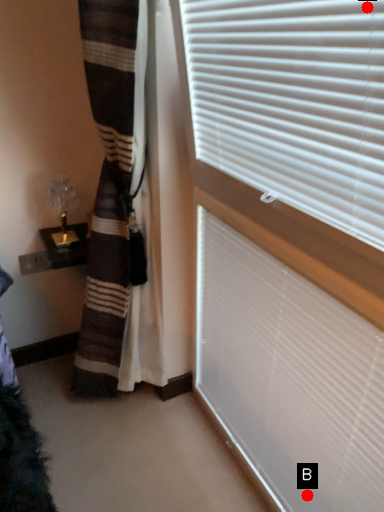
Question: Two points are circled on the image, labeled by A and B beside each circle. Which point is farther to the camera?

Choices:
 (A) A is further
 (B) B is further

Answer: (B)